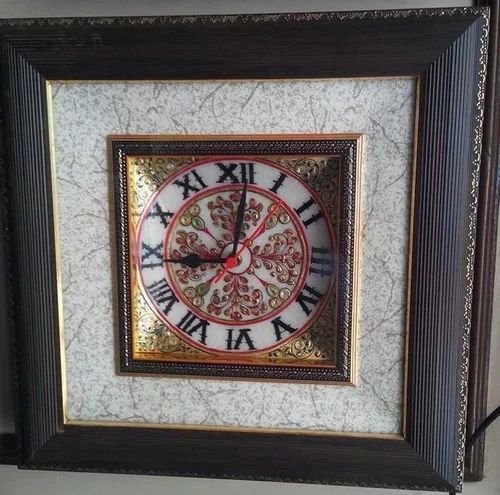
Locate an element on the screen. black wooden clock frame is located at coordinates (24, 235), (431, 364), (316, 460), (275, 64).